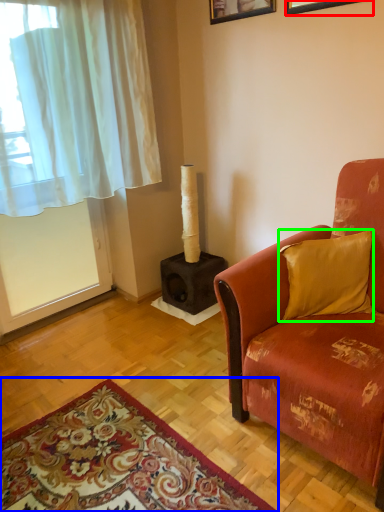
Question: Which is farther away from picture frame (highlighted by a red box)? mat (highlighted by a blue box) or pillow (highlighted by a green box)?

Choices:
 (A) mat
 (B) pillow

Answer: (A)